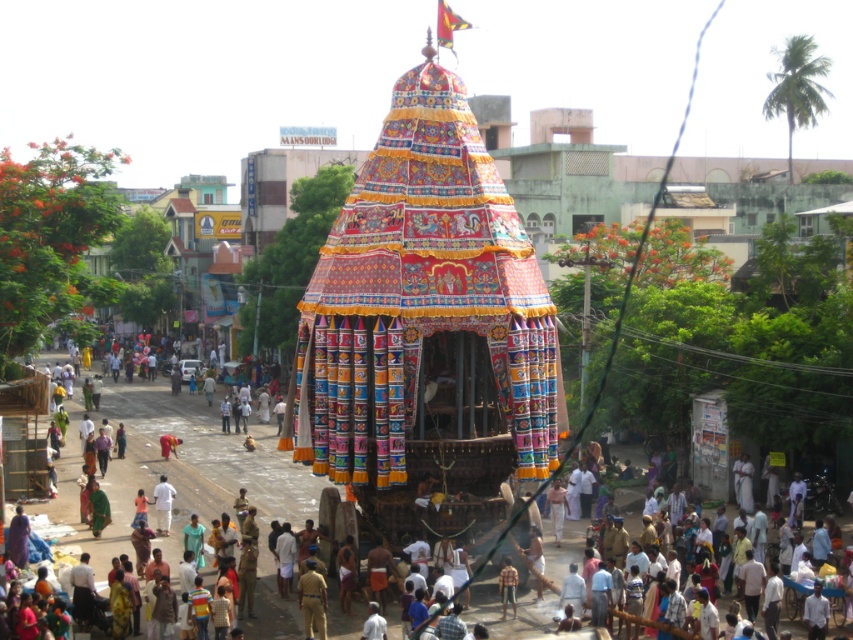
Does point (321, 632) come in front of point (514, 572)?

Yes, it is.

Is point (321, 636) positioned behind point (511, 570)?

That is False.

Find the location of a particular element. This screenshot has height=640, width=853. brown uniform at center is located at coordinates (312, 600).

This screenshot has height=640, width=853. Identify the location of brown uniform at center. (312, 600).

Between wooden cart at center and striped shirt at center, which one appears on the right side from the viewer's perspective?

striped shirt at center is more to the right.

Identify the location of wooden cart at center. [202, 481].

Which is in front, point (563, 547) or point (503, 598)?

Point (503, 598)

Find the location of `wooden cart at center`. wooden cart at center is located at coordinates (202, 481).

Does wooden cart at center have a smaller size compared to white cotton cloth at center?

Incorrect, wooden cart at center is not smaller in size than white cotton cloth at center.

Does point (636, 499) lie in front of point (161, 480)?

No, (636, 499) is behind (161, 480).

The height and width of the screenshot is (640, 853). Identify the location of wooden cart at center. (202, 481).